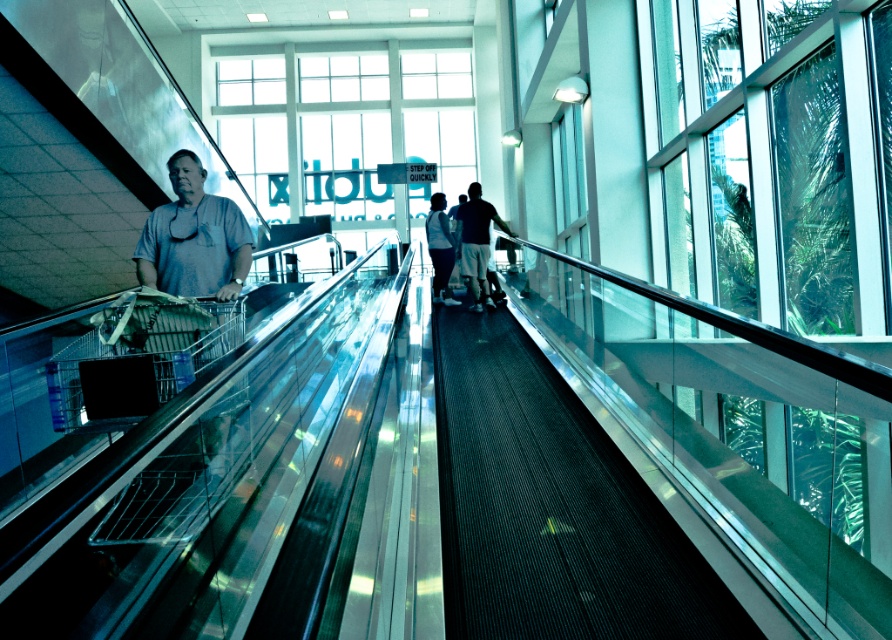
Describe the element at coordinates (476, 244) in the screenshot. I see `dark blue shorts at center` at that location.

Can you confirm if dark blue shorts at center is shorter than light blue jeans at center?

No, dark blue shorts at center is not shorter than light blue jeans at center.

I want to click on dark blue shorts at center, so (x=476, y=244).

In the scene shown: Between gray matte shirt at center and light blue jeans at center, which one appears on the right side from the viewer's perspective?

From the viewer's perspective, light blue jeans at center appears more on the right side.

I want to click on gray matte shirt at center, so tap(193, 237).

Locate an element on the screen. The width and height of the screenshot is (892, 640). gray matte shirt at center is located at coordinates (193, 237).

Is gray matte shirt at center smaller than dark blue shorts at center?

Yes, gray matte shirt at center is smaller than dark blue shorts at center.

This screenshot has height=640, width=892. What do you see at coordinates (193, 237) in the screenshot? I see `gray matte shirt at center` at bounding box center [193, 237].

Locate an element on the screen. The width and height of the screenshot is (892, 640). gray matte shirt at center is located at coordinates (193, 237).